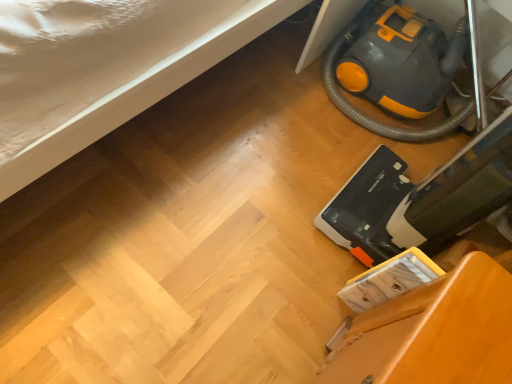
Where is `vacant space in front of yellow-orange plastic vacuum cleaner at lower right, which is counted as the second equipment, starting from the front`? Image resolution: width=512 pixels, height=384 pixels. vacant space in front of yellow-orange plastic vacuum cleaner at lower right, which is counted as the second equipment, starting from the front is located at coordinates (292, 177).